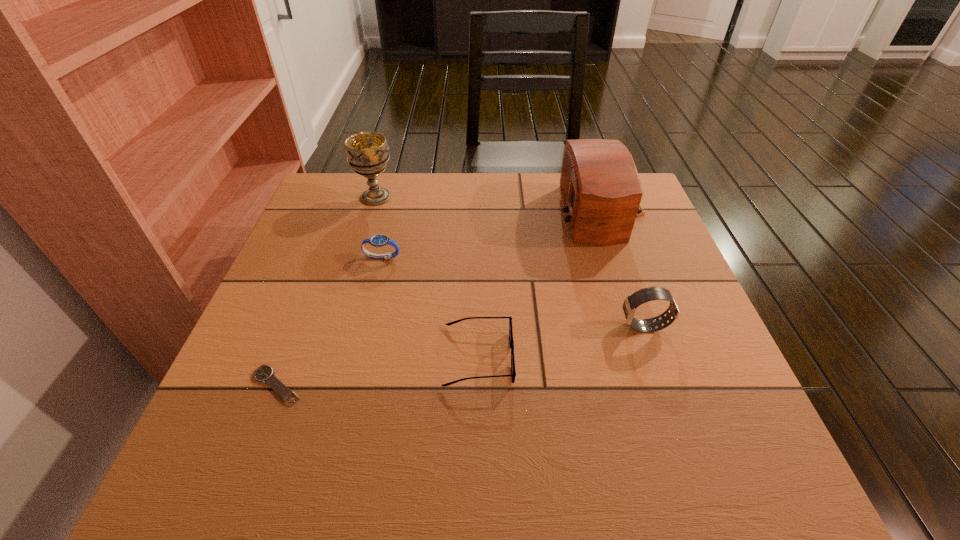
This screenshot has height=540, width=960. I want to click on radio receiver that is positioned at the far edge, so click(601, 190).

Find the location of a particular element. The height and width of the screenshot is (540, 960). chalice present at the far edge is located at coordinates (367, 152).

You are a GUI agent. You are given a task and a screenshot of the screen. Output one action in this format:
    pyautogui.click(x=<x>, y=<y>)
    Task: Click on the chalice that is at the left edge
    This screenshot has width=960, height=540.
    Given the screenshot: What is the action you would take?
    pyautogui.click(x=367, y=152)

At what (x,y) coordinates should I click in order to perform the action: click on watch present at the left edge. Please return your answer as a coordinate pair (x, y). Image resolution: width=960 pixels, height=540 pixels. Looking at the image, I should click on (265, 374).

Find the location of a particular element. radio receiver positioned at the right edge is located at coordinates (601, 190).

This screenshot has width=960, height=540. Identify the location of watch at the right edge. (644, 295).

You are a GUI agent. You are given a task and a screenshot of the screen. Output one action in this format:
    pyautogui.click(x=<x>, y=<y>)
    Task: Click on the object that is at the far left corner
    This screenshot has height=540, width=960.
    Given the screenshot: What is the action you would take?
    pyautogui.click(x=367, y=152)

Identify the location of object present at the far right corner. The width and height of the screenshot is (960, 540). (601, 190).

Where is `blank space at the far edge of the desktop`? This screenshot has height=540, width=960. blank space at the far edge of the desktop is located at coordinates (492, 200).

Image resolution: width=960 pixels, height=540 pixels. In the image, there is a desktop. Identify the location of vacant space at the near edge. (306, 472).